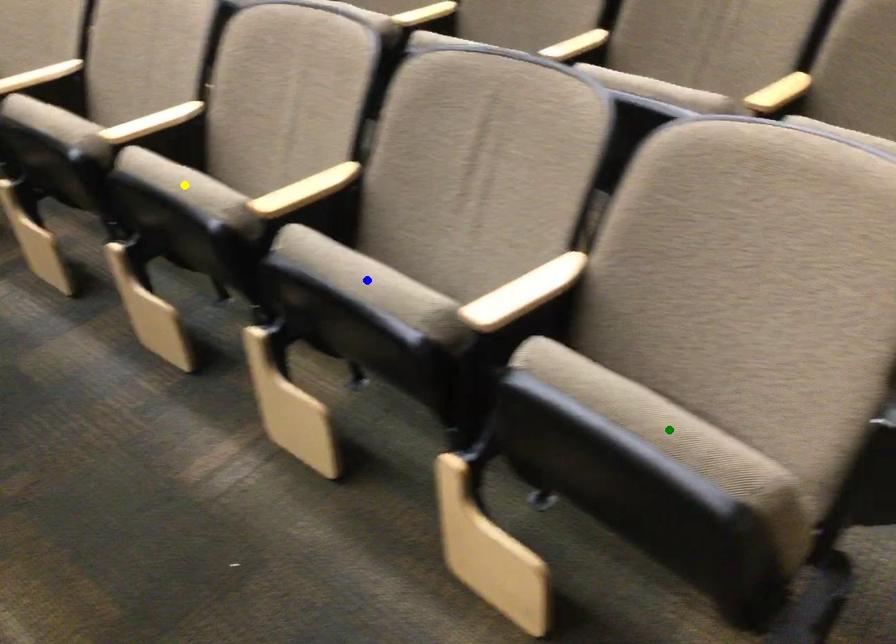
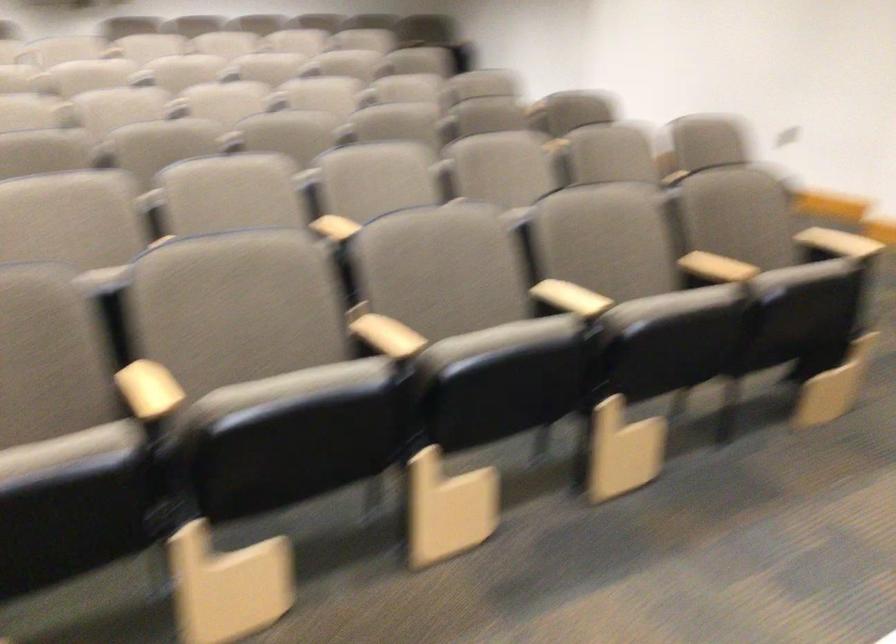
I am providing you with two images of the same scene from different viewpoints. Three points are marked in image1. Which point corresponds to a part or object that is occluded in image2?In image1, three points are marked. Which of them correspond to a part or object that is occluded in image2?Among the three points shown in image1, which one corresponds to a part or object that is no longer visible due to occlusion in image2?

green point, blue point, yellow point